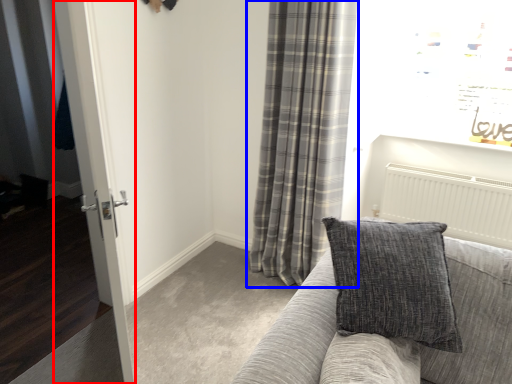
Question: Which point is further to the camera, glass door (highlighted by a red box) or curtain (highlighted by a blue box)?

Choices:
 (A) glass door
 (B) curtain

Answer: (B)